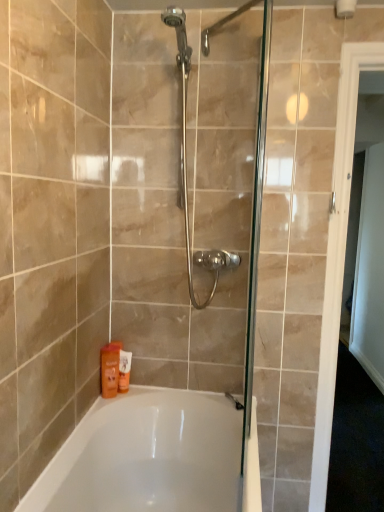
Where is `empty space that is to the right of orange matte lotion at lower left, the first toiletry viewed from the back`? Image resolution: width=384 pixels, height=512 pixels. empty space that is to the right of orange matte lotion at lower left, the first toiletry viewed from the back is located at coordinates (161, 389).